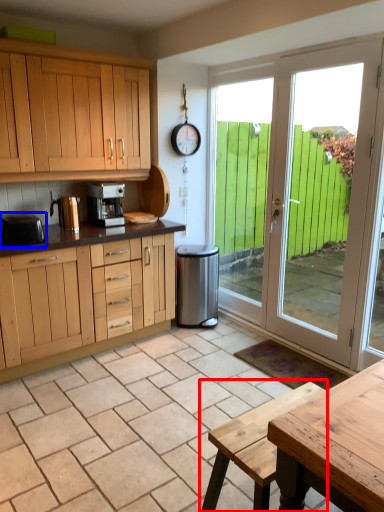
Question: Which point is further to the camera, picnic table (highlighted by a red box) or appliance (highlighted by a blue box)?

Choices:
 (A) picnic table
 (B) appliance

Answer: (B)